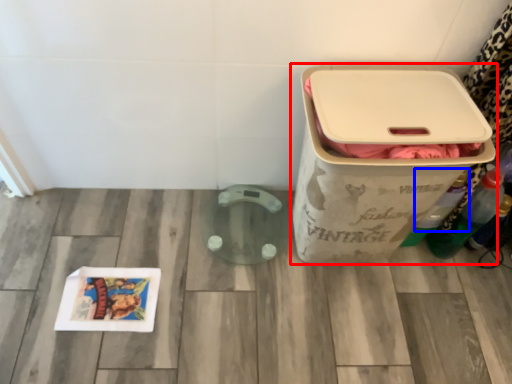
Question: Which object appears farthest to the camera in this image, waste container (highlighted by a red box) or bottle (highlighted by a blue box)?

Choices:
 (A) waste container
 (B) bottle

Answer: (B)